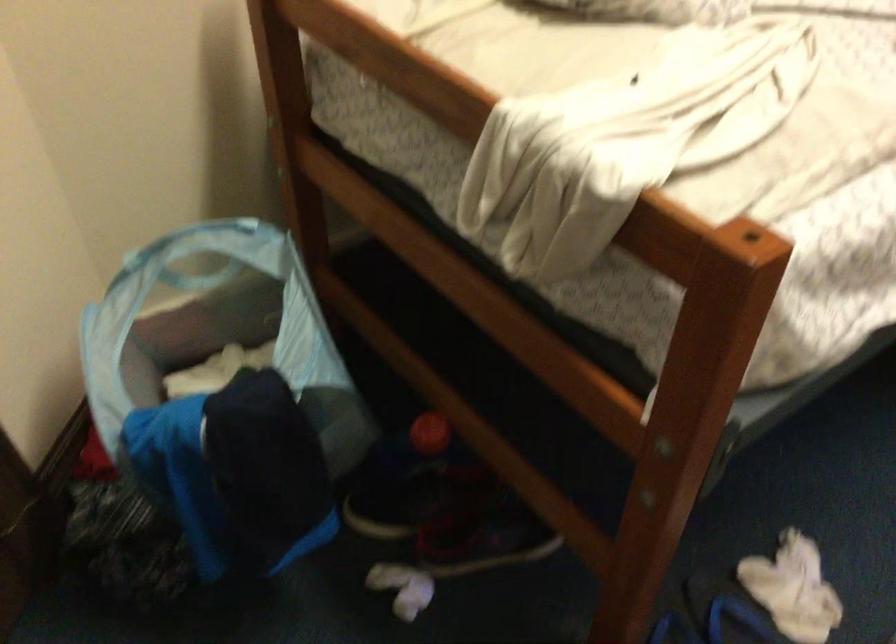
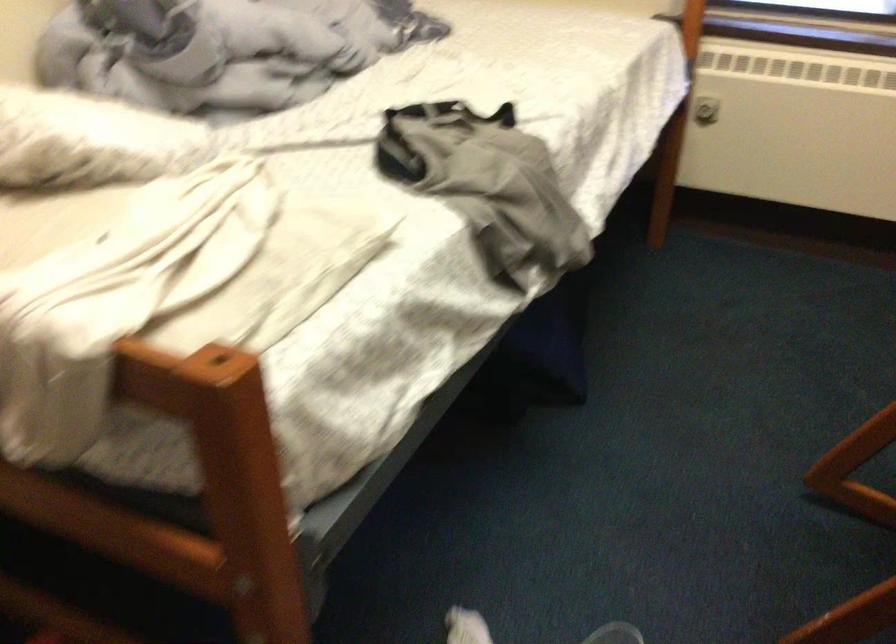
Question: Based on the continuous images, in which direction is the camera rotating? Reply with the corresponding letter.

Choices:
 (A) Left
 (B) Right
 (C) Up
 (D) Down

Answer: (B)